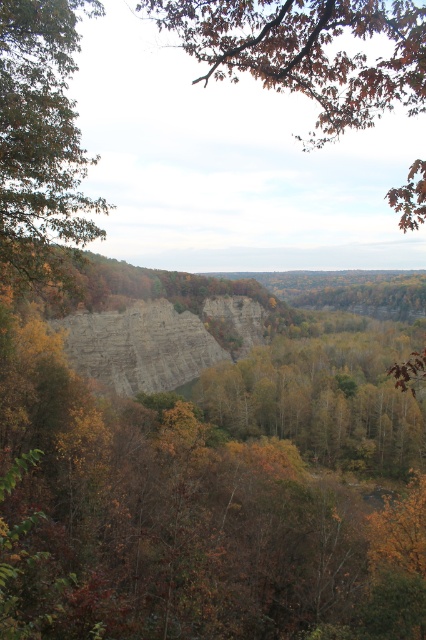
Question: Among these objects, which one is nearest to the camera?

Choices:
 (A) brown matte tree at left
 (B) brown leafy branch at upper center

Answer: (B)

Question: Does brown leafy branch at upper center appear on the right side of brown matte tree at left?

Choices:
 (A) no
 (B) yes

Answer: (B)

Question: Does brown leafy branch at upper center appear under gray rocky cliff at center?

Choices:
 (A) no
 (B) yes

Answer: (A)

Question: Is brown leafy branch at upper center bigger than brown matte tree at left?

Choices:
 (A) yes
 (B) no

Answer: (A)

Question: Which point is closer to the camera taking this photo?

Choices:
 (A) (417, 195)
 (B) (129, 336)

Answer: (A)

Question: Which object is the farthest from the gray rocky cliff at center?

Choices:
 (A) brown leafy branch at upper center
 (B) brown matte tree at left

Answer: (A)